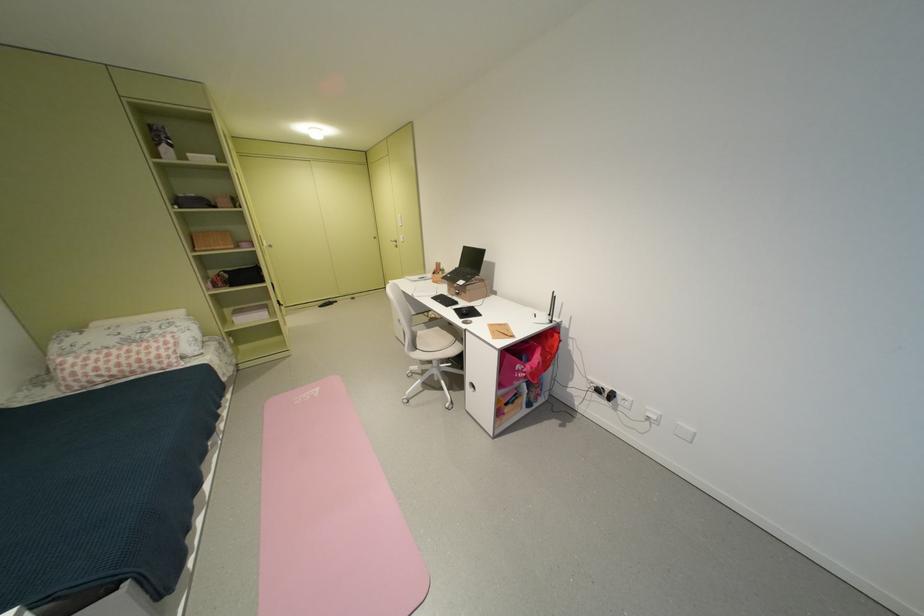
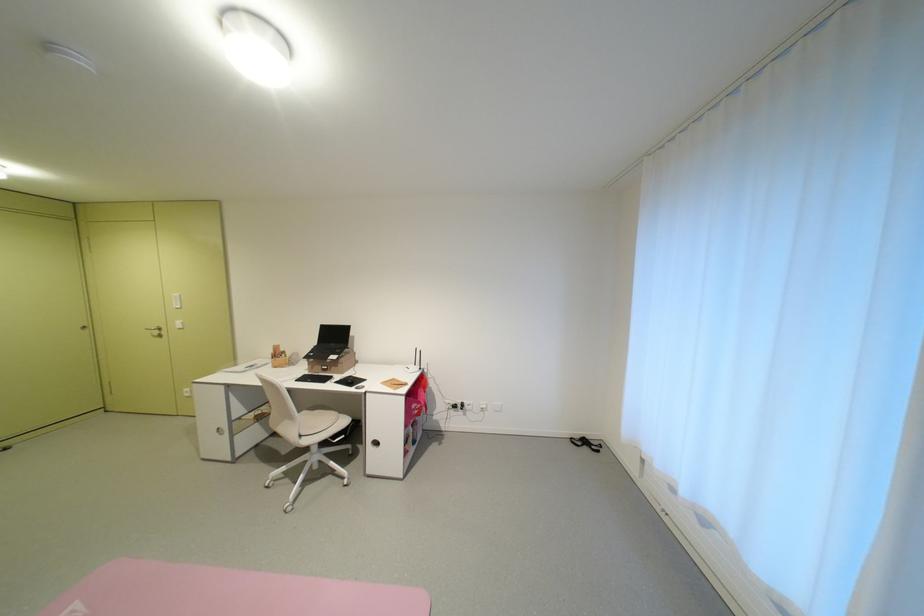
Locate, in the second image, the point that corresponds to pixel 409 325 in the first image.

(232, 435)